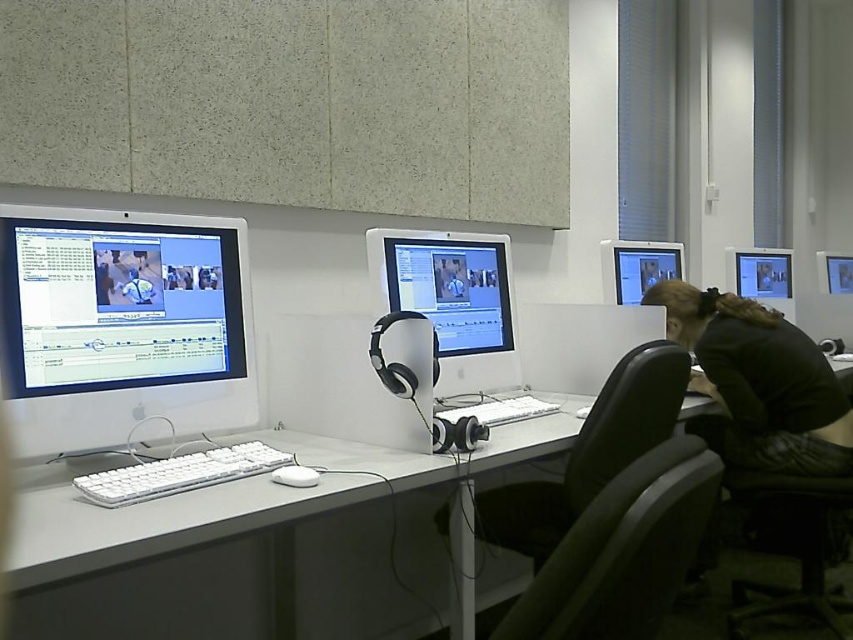
Question: Which object is positioned closest to the black leather swivel chair at center?

Choices:
 (A) matte black monitor at right
 (B) white glossy computer monitor at center
 (C) matte black monitor at upper right
 (D) white plastic keyboard at center

Answer: (B)

Question: Does white glossy monitor at left lie behind matte black monitor at upper right?

Choices:
 (A) yes
 (B) no

Answer: (B)

Question: Can you confirm if black leather jacket at lower right is positioned to the right of white plastic keyboard at center?

Choices:
 (A) yes
 (B) no

Answer: (A)

Question: Which point is farther to the camera?

Choices:
 (A) black leather jacket at lower right
 (B) matte black monitor at upper right
 (C) white plastic computer desk at center
 (D) white glossy computer monitor at center

Answer: (B)

Question: Can you confirm if black leather swivel chair at center is thinner than matte black monitor at right?

Choices:
 (A) no
 (B) yes

Answer: (A)

Question: Which object is farther from the camera taking this photo?

Choices:
 (A) white glossy computer monitor at center
 (B) white glossy monitor at left
 (C) white plastic keyboard at center
 (D) white plastic computer desk at center

Answer: (A)